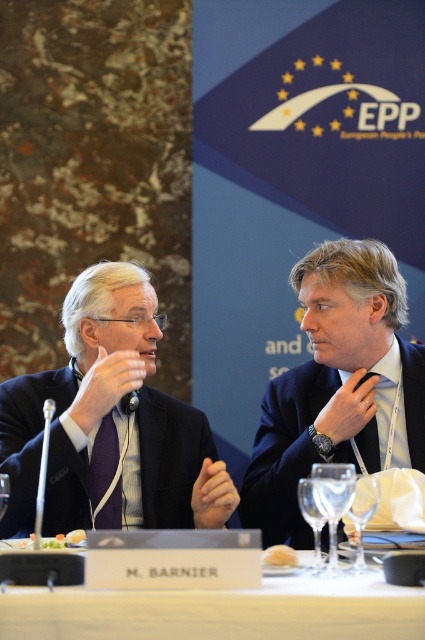
Question: In this image, where is transparent glass at lower center located relative to transparent glass wine glass at lower center?

Choices:
 (A) below
 (B) above

Answer: (B)

Question: Which object appears farthest from the camera in this image?

Choices:
 (A) silver metallic microphone at left
 (B) transparent glass at lower center
 (C) purple silk tie at left

Answer: (C)

Question: Can you confirm if white glossy table at center is positioned to the left of purple silk tie at left?

Choices:
 (A) yes
 (B) no

Answer: (B)

Question: Which point is closer to the camera?

Choices:
 (A) (340, 499)
 (B) (345, 316)

Answer: (A)

Question: Can you confirm if transparent glass wine glass at lower center is positioned to the left of silver metallic microphone at left?

Choices:
 (A) no
 (B) yes

Answer: (A)

Question: Based on their relative distances, which object is nearer to the transparent glass at lower center?

Choices:
 (A) white glossy table at center
 (B) satin blue suit at center

Answer: (A)